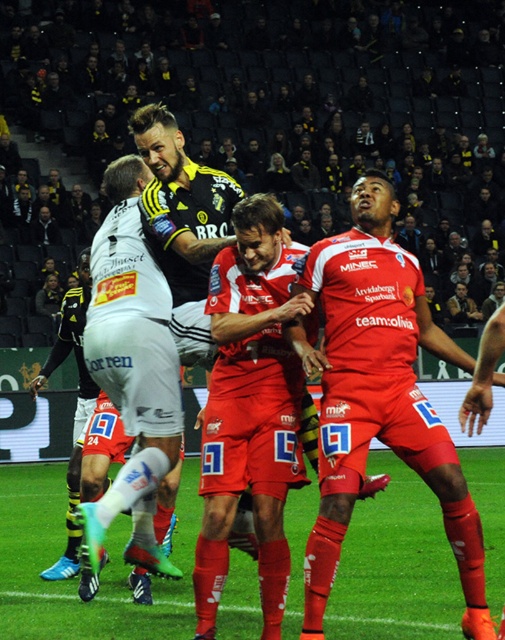
You are a soccer player positioned at the center of the field. You need to pass the ball to your teammate wearing white matte shorts at center. Where should you aim your pass?

The white matte shorts at center is located at point (130,372), so you should aim your pass towards that coordinate.

You are a soccer player positioned at the edge of the field. You need to pass the ball to your teammate located at point [76,577]. Based on the scene description, what is the surface you will be passing the ball on?

The surface at point [76,577] is the green grass football field at center, so you will be passing the ball on the green grass football field at center.